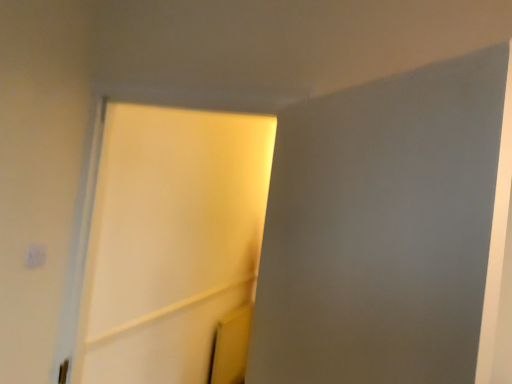
Question: Is white matte light switch at upper left taller or shorter than white matte screen door at center, which is the first screen door in back-to-front order?

Choices:
 (A) tall
 (B) short

Answer: (B)

Question: From a real-world perspective, relative to white matte screen door at center, the 2th screen door viewed from the front, is white matte light switch at upper left vertically above or below?

Choices:
 (A) below
 (B) above

Answer: (A)

Question: Which of these objects is positioned closest to the white matte screen door at center, which is the first screen door in left-to-right order?

Choices:
 (A) white matte light switch at upper left
 (B) white matte screen door at upper center, positioned as the 2th screen door in back-to-front order

Answer: (B)

Question: Which object is positioned closest to the white matte light switch at upper left?

Choices:
 (A) white matte screen door at center, marked as the 2th screen door in a right-to-left arrangement
 (B) white matte screen door at upper center, positioned as the 2th screen door in back-to-front order

Answer: (B)